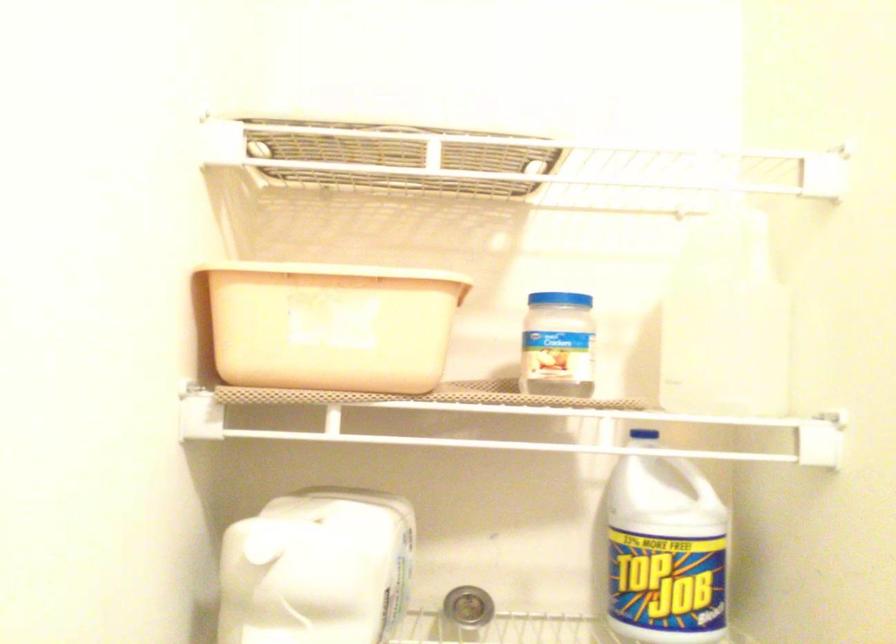
Find where to unscrew the blue jar lid. Please return your answer as a coordinate pair (x, y).

(558, 299)